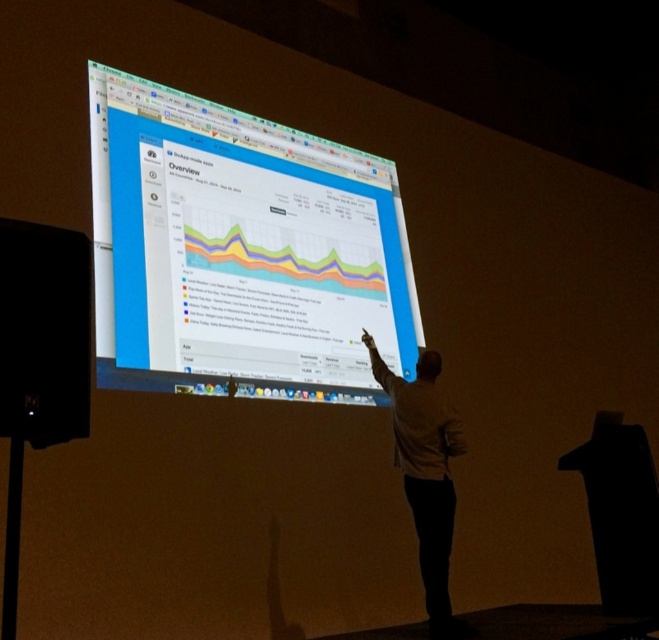
Does matte black monitor at center have a smaller size compared to black matte speaker at lower left?

Incorrect, matte black monitor at center is not smaller in size than black matte speaker at lower left.

Can you confirm if matte black monitor at center is thinner than black matte speaker at lower left?

In fact, matte black monitor at center might be wider than black matte speaker at lower left.

Which is behind, point (362, 262) or point (61, 259)?

The point (362, 262) is behind.

Where is `matte black monitor at center`? matte black monitor at center is located at coordinates (241, 252).

Is matte black monitor at center positioned in front of white matte shirt at center?

No, matte black monitor at center is further to the viewer.

Who is more forward, (100, 333) or (418, 429)?

Point (100, 333) is more forward.

Is point (148, 330) positioned in front of point (370, 353)?

That is True.

Where is `matte black monitor at center`? The width and height of the screenshot is (659, 640). matte black monitor at center is located at coordinates (241, 252).

Is black matte speaker at lower left positioned at the back of white matte shirt at center?

That is False.

Can you confirm if black matte speaker at lower left is positioned to the right of white matte shirt at center?

No, black matte speaker at lower left is not to the right of white matte shirt at center.

What do you see at coordinates (43, 332) in the screenshot? I see `black matte speaker at lower left` at bounding box center [43, 332].

Where is `black matte speaker at lower left`? The height and width of the screenshot is (640, 659). black matte speaker at lower left is located at coordinates (43, 332).